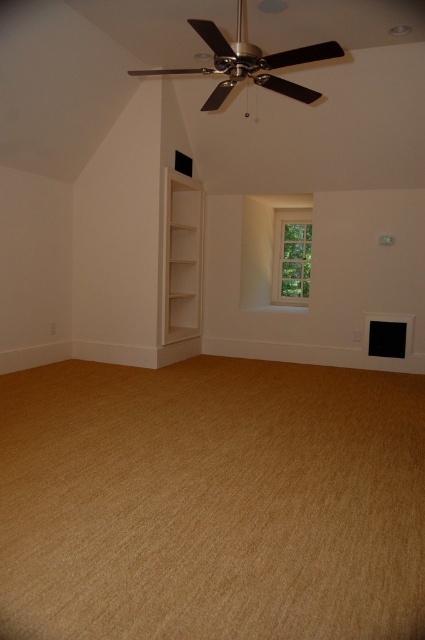
Which is above, white wood bookshelf at lower left or clear glass window at center?

clear glass window at center is above.

Can you confirm if white wood bookshelf at lower left is positioned to the left of clear glass window at center?

Indeed, white wood bookshelf at lower left is positioned on the left side of clear glass window at center.

Does point (178, 211) lie behind point (303, 241)?

No.

The width and height of the screenshot is (425, 640). Find the location of `white wood bookshelf at lower left`. white wood bookshelf at lower left is located at coordinates (181, 257).